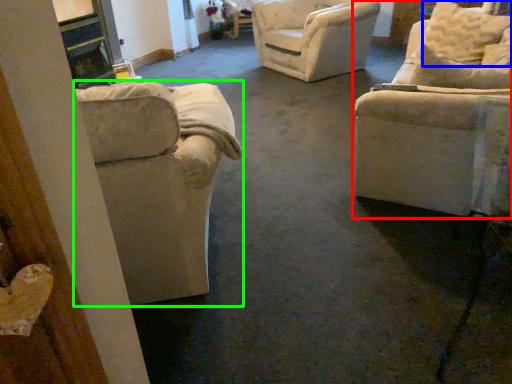
Question: Which object is the closest to the chair (highlighted by a red box)? Choose among these: pillow (highlighted by a blue box) or chair (highlighted by a green box).

Choices:
 (A) pillow
 (B) chair

Answer: (B)